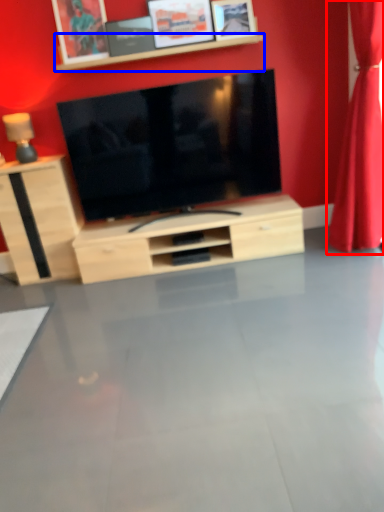
Question: Which point is closer to the camera, curtain (highlighted by a red box) or shelf (highlighted by a blue box)?

Choices:
 (A) curtain
 (B) shelf

Answer: (A)